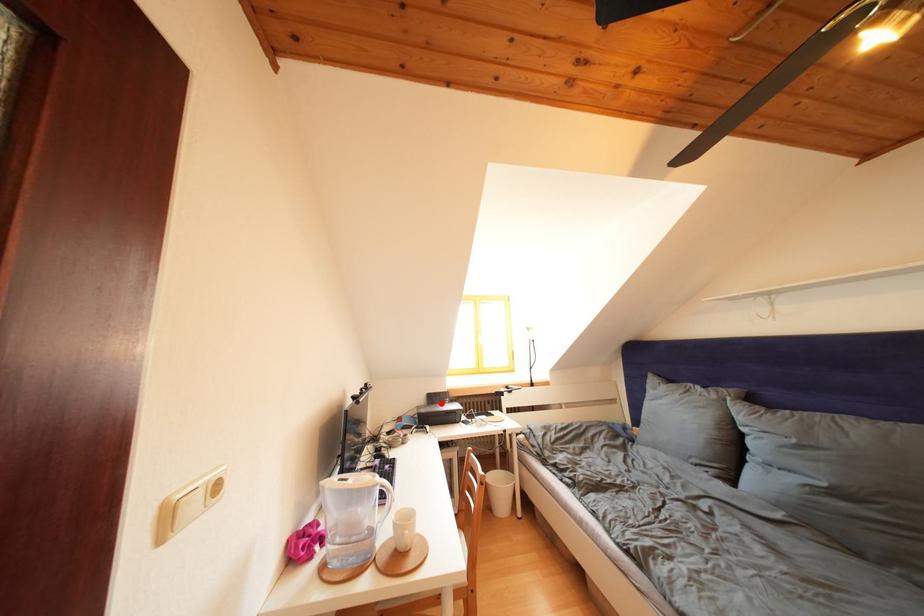
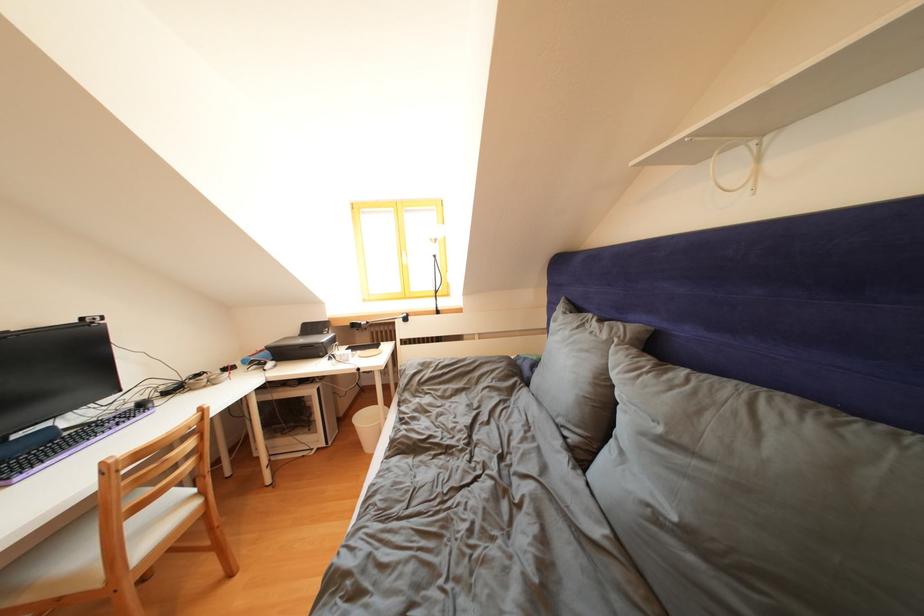
Question: I am providing you with two images of the same scene from different viewpoints. Given a red point in image1, look at the same physical point in image2. Is it:

Choices:
 (A) Closer to the viewpoint
 (B) Farther from the viewpoint

Answer: (A)